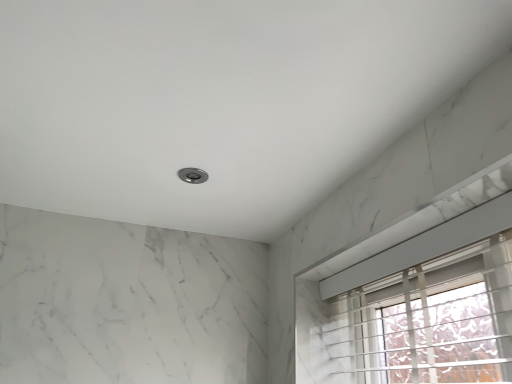
You are a GUI agent. You are given a task and a screenshot of the screen. Output one action in this format:
    pyautogui.click(x=<x>, y=<y>)
    Task: Click on the white marble window at upper right
    This screenshot has height=384, width=512.
    Given the screenshot: What is the action you would take?
    pyautogui.click(x=417, y=296)

What do you see at coordinates (417, 296) in the screenshot? The image size is (512, 384). I see `white marble window at upper right` at bounding box center [417, 296].

Identify the location of white marble window at upper right. (417, 296).